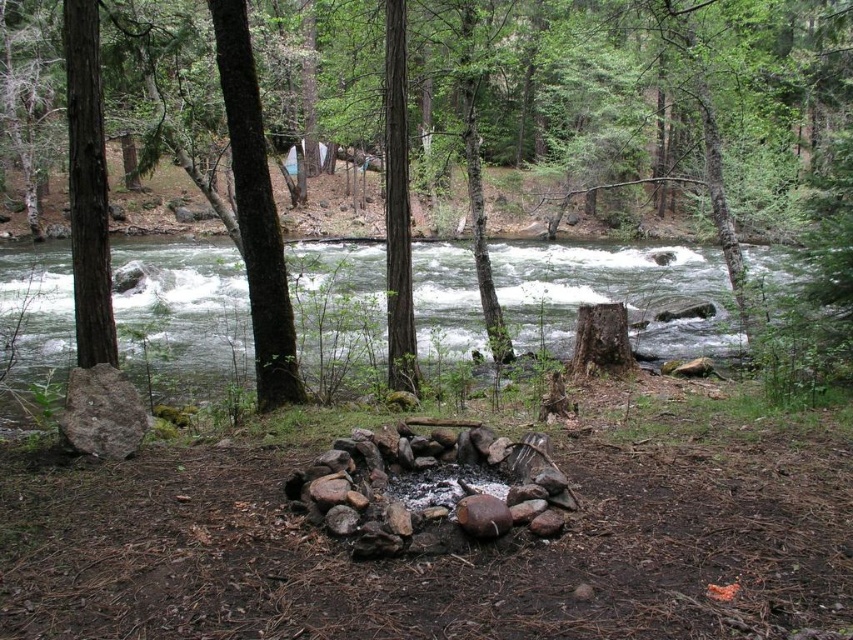
You are a hiker carrying a 1.2 meter long wooden plank. You want to place it between the brown rough bark tree at center and the brown rough bark tree at left so that both ends of the plank touch the trees. Is this possible?

The distance between the brown rough bark tree at center and the brown rough bark tree at left is 1.16 meters. Since the plank is 1.2 meters long, which is slightly longer than the distance between the trees, it won

You are standing at the fire pit and want to walk to the tree on the far right. Which tree should you head towards, the brown rough bark tree at center or the brown rough bark tree at left?

You should head towards the brown rough bark tree at center because it is positioned on the right side of the brown rough bark tree at left, making it the one on the far right.